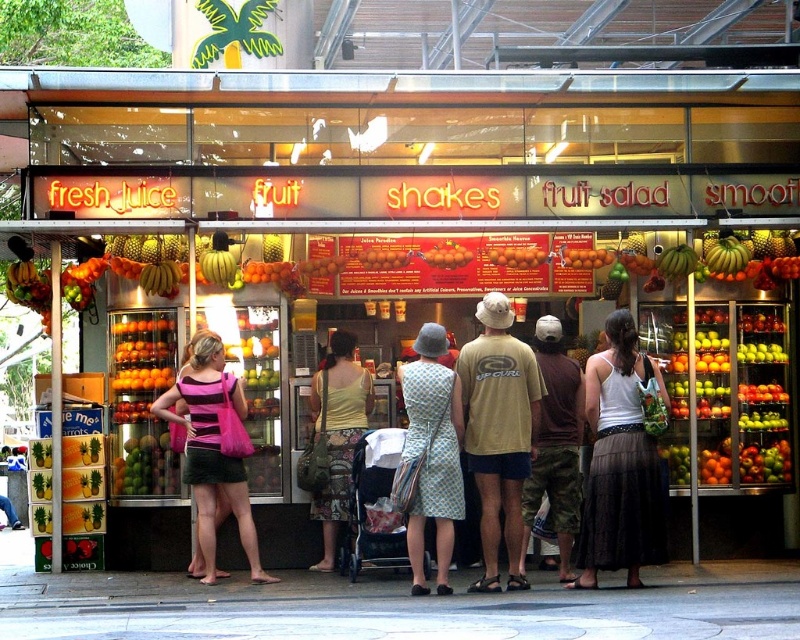
Does shiny plastic fruits at center come in front of printed fabric dress at center?

No, it is not.

In the scene shown: Does shiny plastic fruits at center come behind printed fabric dress at center?

Yes.

Is point (190, 324) more distant than point (437, 470)?

Yes, it is behind point (437, 470).

This screenshot has width=800, height=640. I want to click on shiny plastic fruits at center, so click(x=724, y=397).

Does point (746, 467) come farther from viewer compared to point (496, 509)?

Yes.

Is shiny plastic fruits at center smaller than beige cotton t-shirt at center?

Yes, shiny plastic fruits at center is smaller than beige cotton t-shirt at center.

Who is more distant from viewer, (720, 422) or (474, 424)?

Point (720, 422)

Find the location of a particular element. The width and height of the screenshot is (800, 640). shiny plastic fruits at center is located at coordinates (724, 397).

Who is positioned more to the left, camouflage pants at center or green matte bananas at center?

From the viewer's perspective, camouflage pants at center appears more on the left side.

Who is lower down, camouflage pants at center or green matte bananas at center?

Positioned lower is camouflage pants at center.

Is point (562, 529) positioned behind point (682, 273)?

No, it is in front of (682, 273).

Locate an element on the screen. camouflage pants at center is located at coordinates (556, 444).